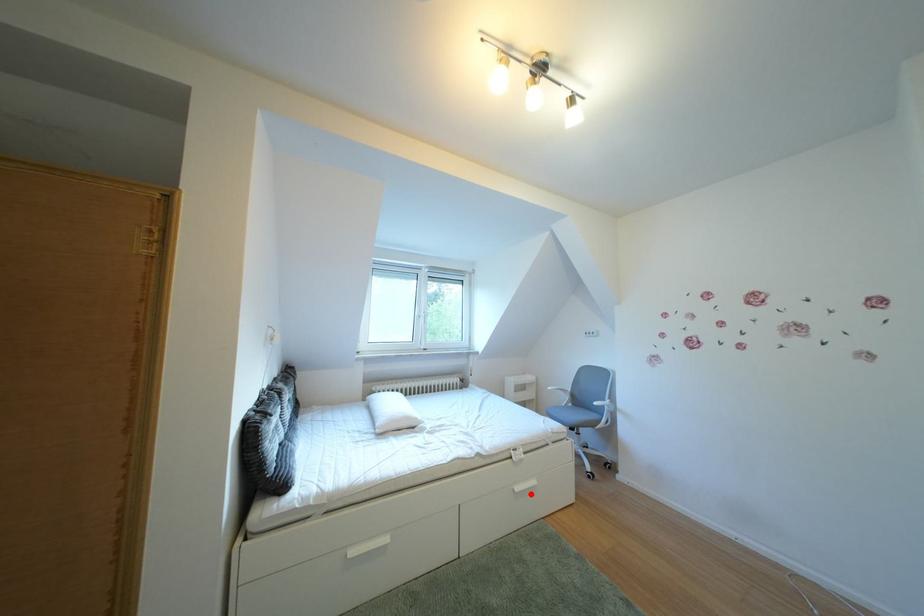
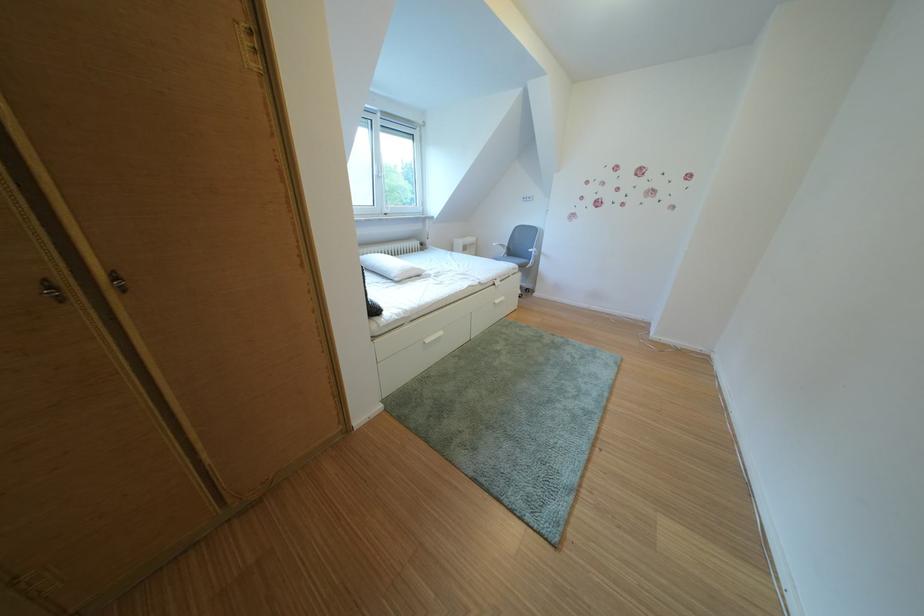
Locate, in the second image, the point that corresponds to the highlighted location in the first image.

(511, 307)